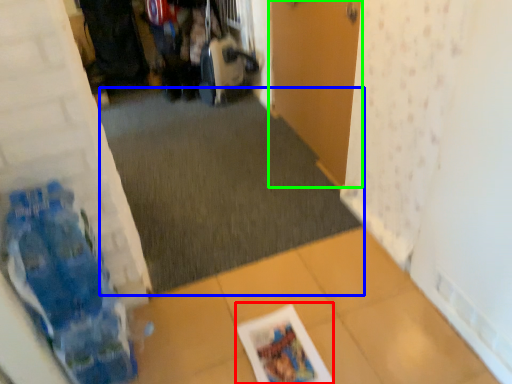
Question: Which object is the farthest from magazine (highlighted by a red box)? Choose among these: plain (highlighted by a blue box) or door (highlighted by a green box).

Choices:
 (A) plain
 (B) door

Answer: (B)